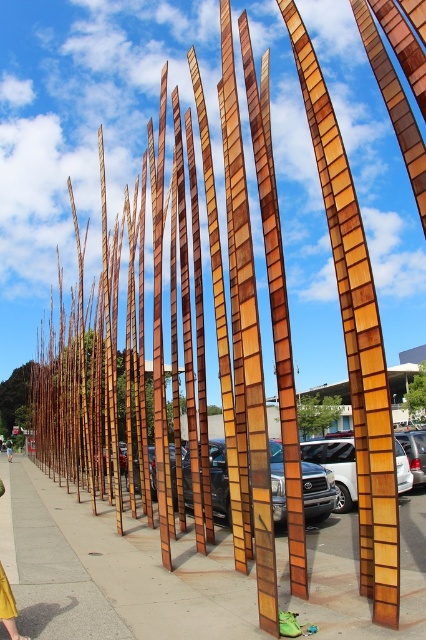
Can you confirm if smooth concrete sidewalk at center is shorter than green fabric person at lower center?

In fact, smooth concrete sidewalk at center may be taller than green fabric person at lower center.

Identify the location of smooth concrete sidewalk at center. Image resolution: width=426 pixels, height=640 pixels. (118, 570).

Which is in front, point (19, 566) or point (8, 449)?

Point (19, 566) is more forward.

What are the coordinates of `smooth concrete sidewalk at center` in the screenshot? It's located at (118, 570).